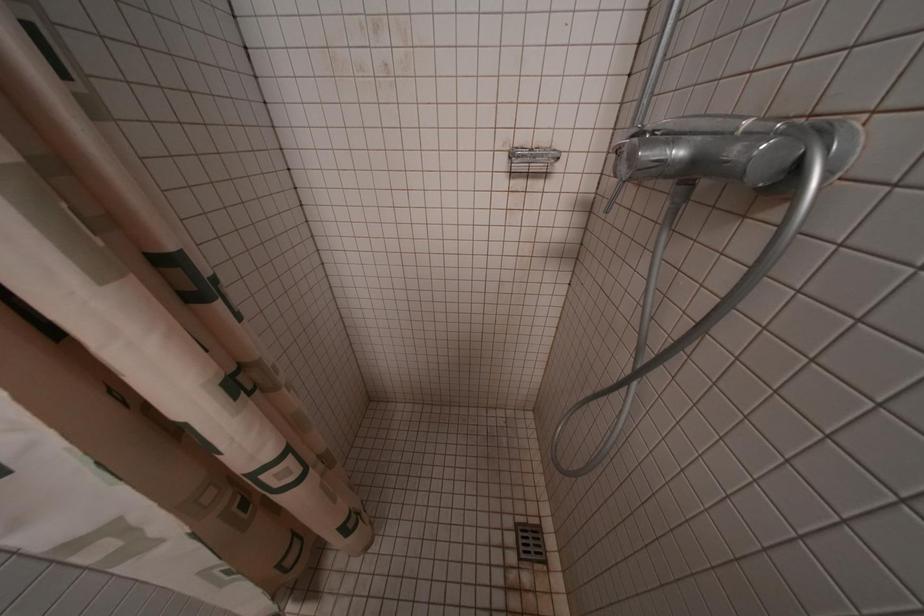
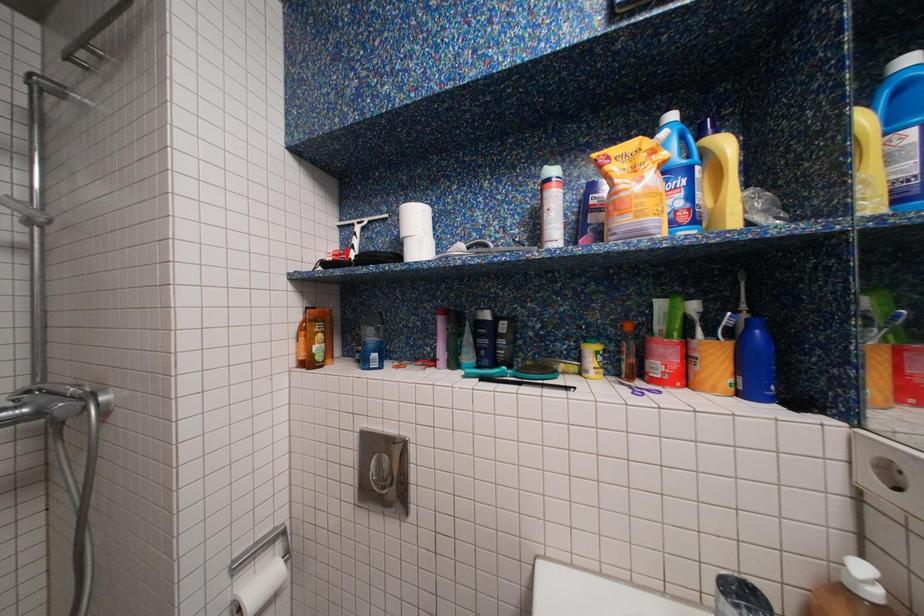
Question: How did the camera likely rotate?

Choices:
 (A) Left
 (B) Right
 (C) Up
 (D) Down

Answer: (B)